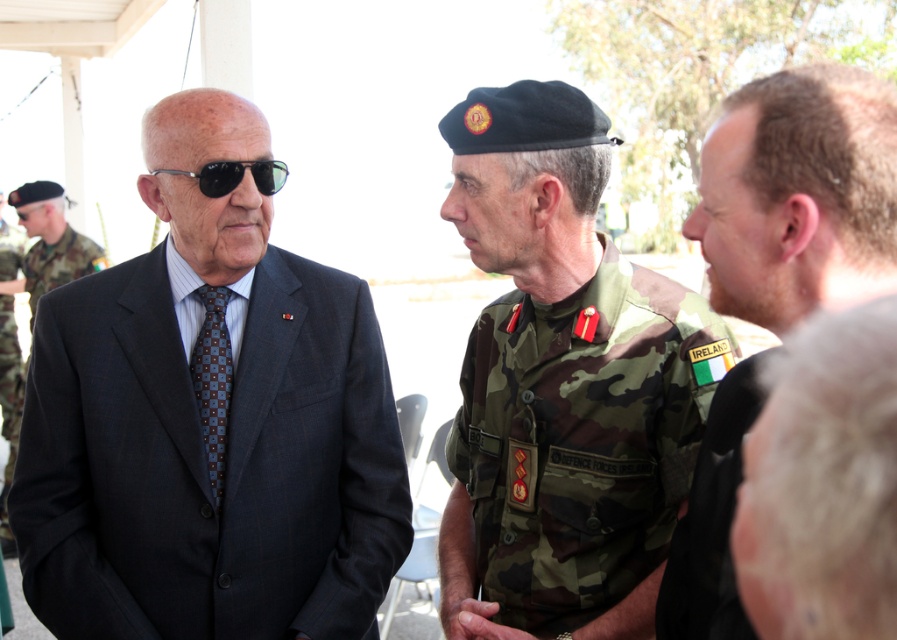
Between camouflage uniform at center and camouflage uniform at left, which one appears on the right side from the viewer's perspective?

Positioned to the right is camouflage uniform at center.

What do you see at coordinates (798, 195) in the screenshot? I see `camouflage uniform at center` at bounding box center [798, 195].

This screenshot has height=640, width=897. Find the location of `camouflage uniform at center`. camouflage uniform at center is located at coordinates (798, 195).

Where is `camouflage uniform at center`? The width and height of the screenshot is (897, 640). camouflage uniform at center is located at coordinates (798, 195).

Does camouflage uniform at center come behind blue textured tie at center?

No, camouflage uniform at center is in front of blue textured tie at center.

I want to click on camouflage uniform at center, so click(798, 195).

Identify the location of camouflage uniform at center. (798, 195).

Looking at this image, is camouflage uniform at left above black reflective sunglasses at left?

Yes, camouflage uniform at left is above black reflective sunglasses at left.

Between camouflage uniform at left and black reflective sunglasses at left, which one appears on the right side from the viewer's perspective?

black reflective sunglasses at left

Is point (71, 257) positioned before point (231, 182)?

No, (71, 257) is behind (231, 182).

Find the location of a particular element. The height and width of the screenshot is (640, 897). camouflage uniform at left is located at coordinates (51, 241).